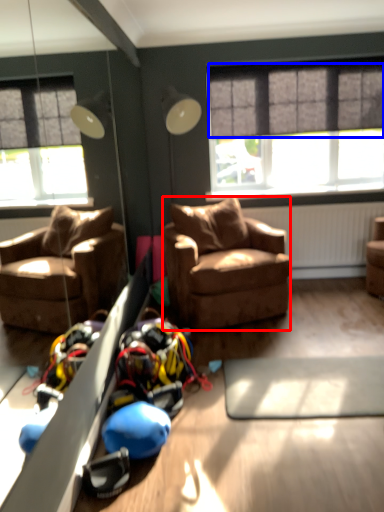
Question: Which point is closer to the camera, studio couch (highlighted by a red box) or curtain (highlighted by a blue box)?

Choices:
 (A) studio couch
 (B) curtain

Answer: (A)